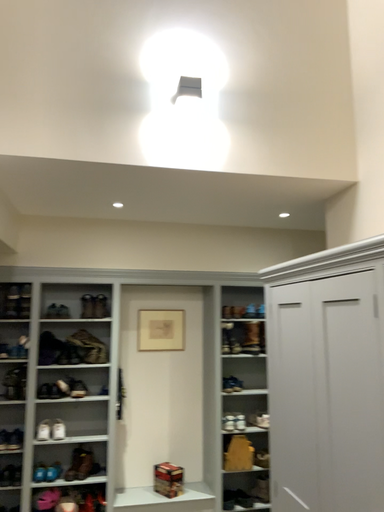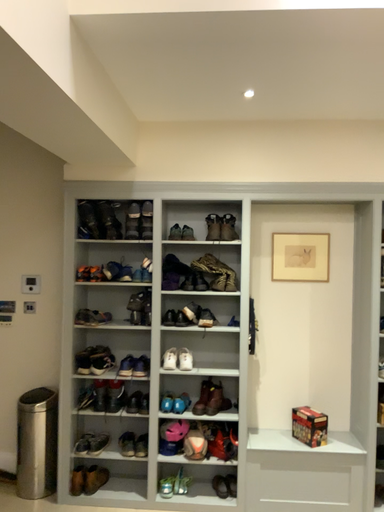
Question: How did the camera likely rotate when shooting the video?

Choices:
 (A) rotated right
 (B) rotated left

Answer: (B)